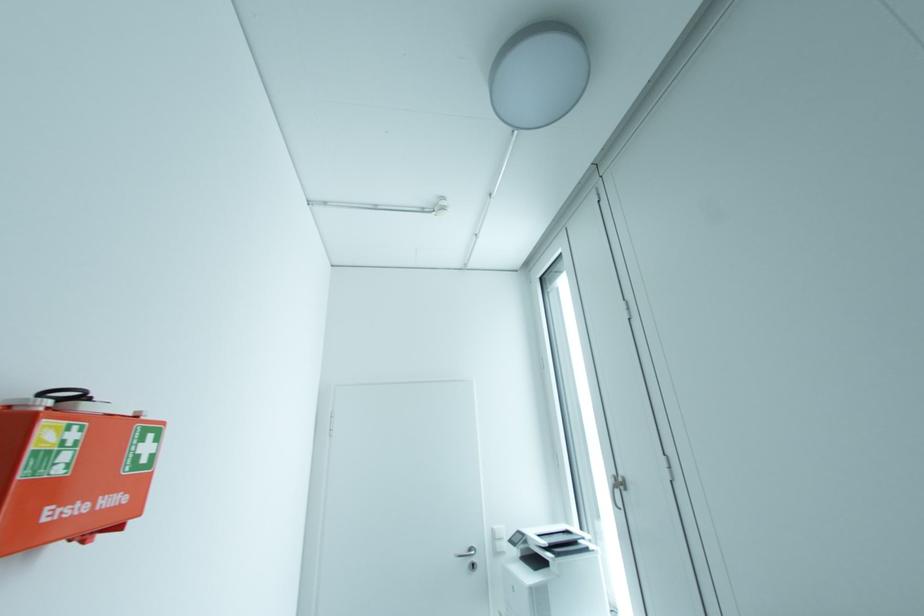
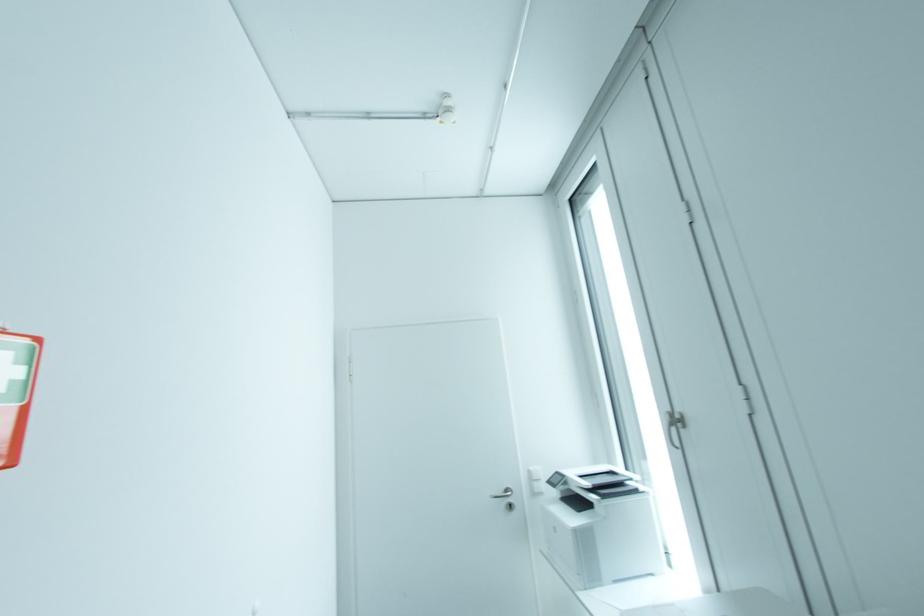
Question: Based on the continuous images, in which direction is the camera rotating? Reply with the corresponding letter.

Choices:
 (A) Left
 (B) Right
 (C) Up
 (D) Down

Answer: (D)